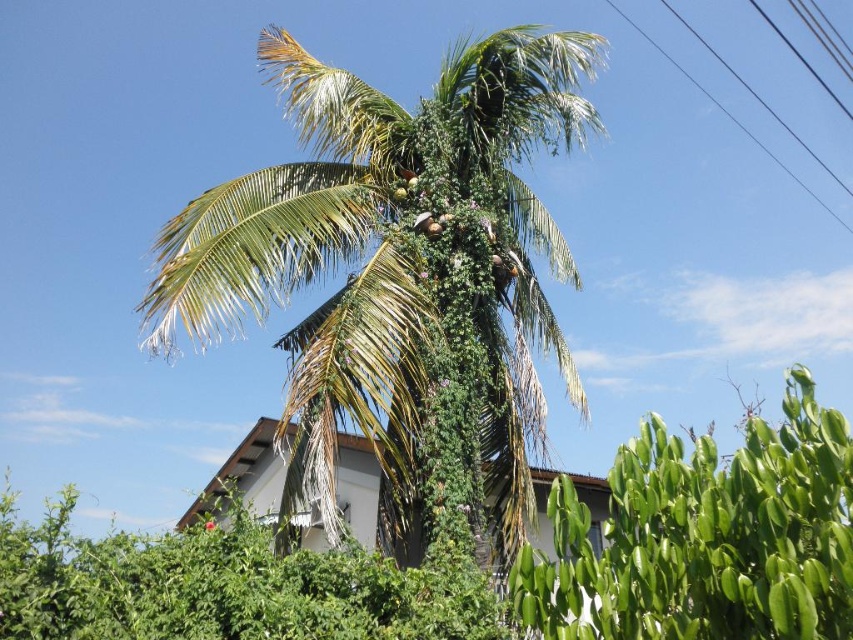
Question: Is green leafy bush at lower left below black wire at upper right?

Choices:
 (A) no
 (B) yes

Answer: (B)

Question: Does green leafy bush at lower left have a lesser width compared to black wire at upper right?

Choices:
 (A) yes
 (B) no

Answer: (B)

Question: Which point is closer to the camera taking this photo?

Choices:
 (A) (338, 620)
 (B) (177, 257)
 (C) (828, 632)
 (D) (833, 212)

Answer: (C)

Question: Can you confirm if green leafy bush at lower left is thinner than black wire at upper right?

Choices:
 (A) yes
 (B) no

Answer: (B)

Question: Which of these objects is positioned farthest from the green leafy bush at lower left?

Choices:
 (A) green leafy bush at lower right
 (B) black wire at upper right
 (C) green leafy coconut tree at center

Answer: (B)

Question: Which object is the farthest from the green leafy coconut tree at center?

Choices:
 (A) black wire at upper right
 (B) green leafy bush at lower left
 (C) green leafy bush at lower right

Answer: (A)